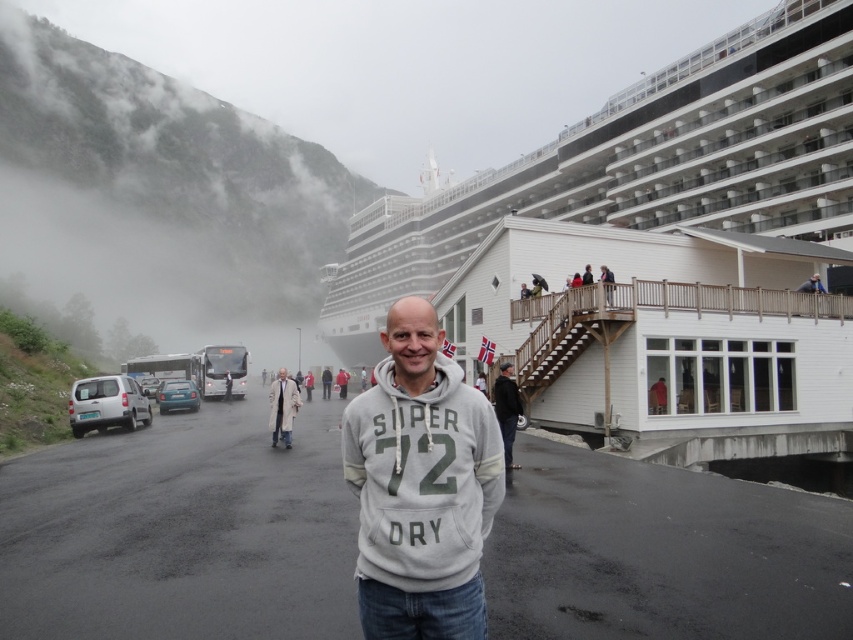
Question: Which point is closer to the camera taking this photo?

Choices:
 (A) (494, 385)
 (B) (428, 637)

Answer: (B)

Question: Which object appears farthest from the camera in this image?

Choices:
 (A) foggy misty mountain at upper left
 (B) black matte jacket at center
 (C) white glossy cruise ship at upper center

Answer: (A)

Question: Among these objects, which one is farthest from the camera?

Choices:
 (A) black matte jacket at center
 (B) white matte van at left
 (C) light brown wooden railing at upper center

Answer: (C)

Question: Is foggy misty mountain at upper left positioned before white cotton hoodie at center?

Choices:
 (A) yes
 (B) no

Answer: (B)

Question: Observing the image, what is the correct spatial positioning of light brown wooden railing at upper center in reference to white cotton hoodie at center?

Choices:
 (A) below
 (B) above

Answer: (B)

Question: Is gray cotton hoodie at center positioned behind white matte van at left?

Choices:
 (A) no
 (B) yes

Answer: (A)